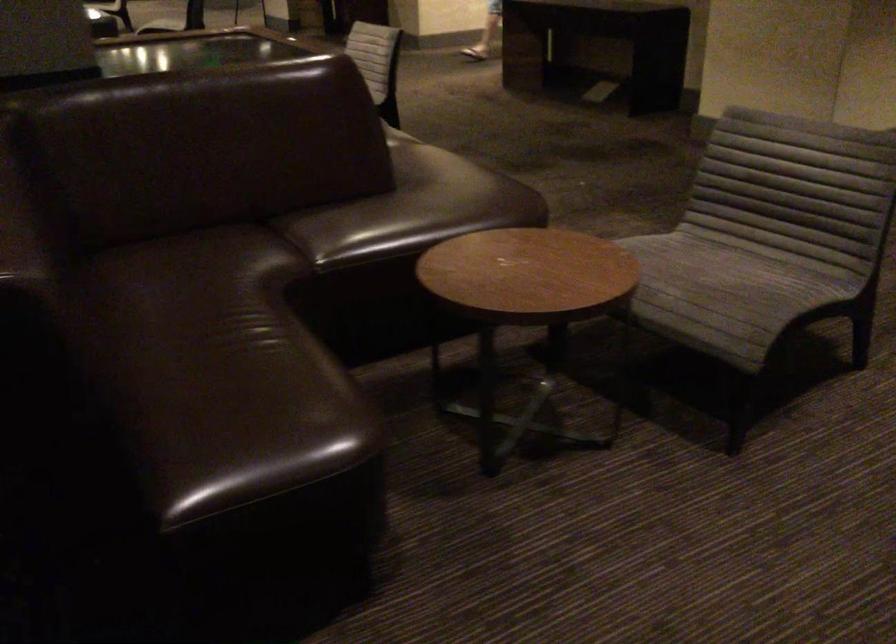
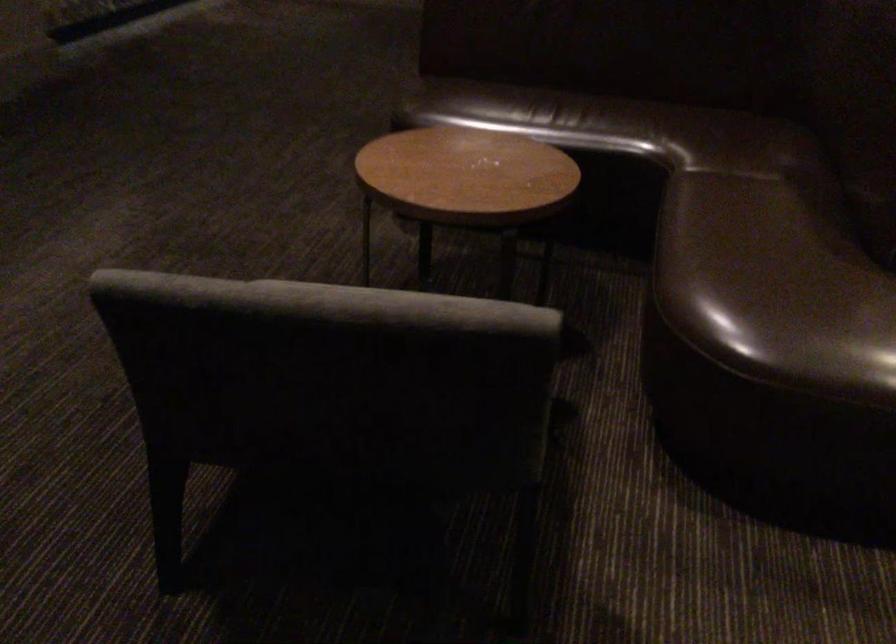
Where in the second image is the point corresponding to [306,386] from the first image?

(494, 108)